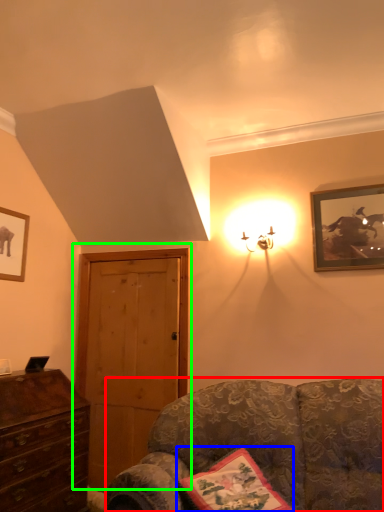
Question: Which is nearer to the studio couch (highlighted by a red box)? pillow (highlighted by a blue box) or door (highlighted by a green box).

Choices:
 (A) pillow
 (B) door

Answer: (A)